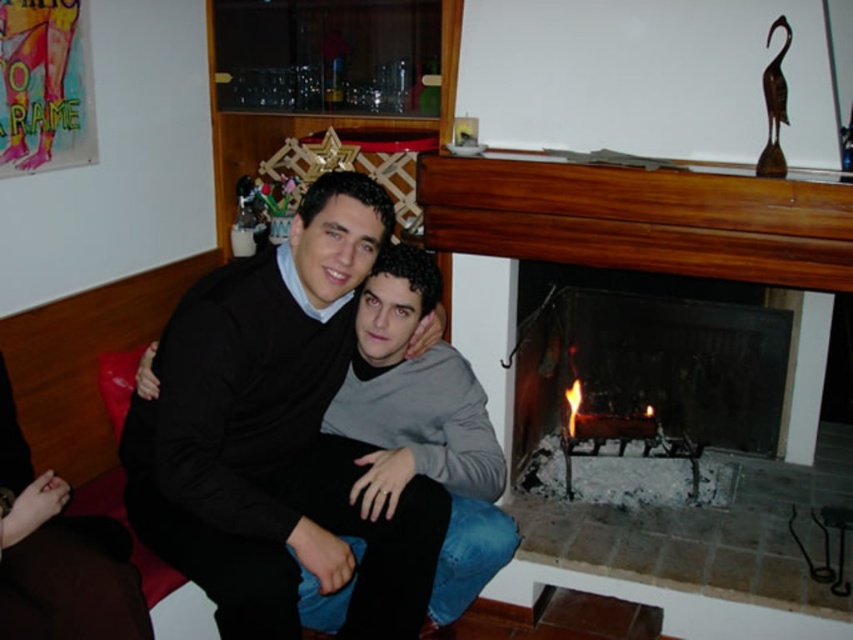
Question: Which of the following is the farthest from the observer?

Choices:
 (A) charcoal gray stone fireplace at right
 (B) matte black sweater at center
 (C) wooden fireplace at right
 (D) gray matte sweater at center

Answer: (A)

Question: Does matte black sweater at center lie behind wooden fireplace at right?

Choices:
 (A) no
 (B) yes

Answer: (A)

Question: Is charcoal gray stone fireplace at right wider than gray matte sweater at center?

Choices:
 (A) no
 (B) yes

Answer: (B)

Question: Which point is farther to the camera?

Choices:
 (A) wooden fireplace at right
 (B) matte black sweater at center
 (C) gray matte sweater at center
 (D) charcoal gray stone fireplace at right

Answer: (D)

Question: Does wooden fireplace at right have a larger size compared to gray matte sweater at center?

Choices:
 (A) yes
 (B) no

Answer: (A)

Question: Which object appears farthest from the camera in this image?

Choices:
 (A) charcoal gray stone fireplace at right
 (B) wooden fireplace at right
 (C) gray matte sweater at center

Answer: (A)